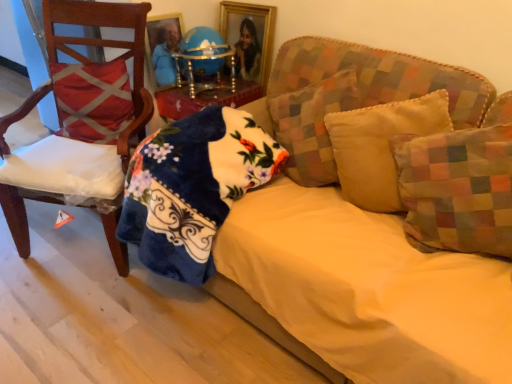
The height and width of the screenshot is (384, 512). Describe the element at coordinates (457, 190) in the screenshot. I see `multicolored fabric pillow at right, which is the first pillow from right to left` at that location.

This screenshot has width=512, height=384. What are the coordinates of `velvet yellow couch at center` in the screenshot? It's located at (368, 288).

This screenshot has height=384, width=512. Describe the element at coordinates (249, 37) in the screenshot. I see `gold/glass picture frame at upper center` at that location.

What is the approximate height of gold/glass picture frame at upper center?

It is 14.66 inches.

What do you see at coordinates (203, 56) in the screenshot? The height and width of the screenshot is (384, 512). I see `blue glossy globe at center` at bounding box center [203, 56].

The height and width of the screenshot is (384, 512). Identify the location of blue glossy globe at center. (203, 56).

I want to click on multicolored fabric pillow at right, the fourth pillow positioned from the left, so click(457, 190).

From a real-world perspective, is wooden chair at left on red fabric pillow at left, which is the 4th pillow in right-to-left order?

No, from a real-world perspective, wooden chair at left is not above red fabric pillow at left, which is the 4th pillow in right-to-left order.

Which point is more distant from viewer, (x=139, y=46) or (x=125, y=75)?

Positioned behind is point (x=139, y=46).

Consider the image. Are wooden chair at left and red fabric pillow at left, which ranks as the first pillow in left-to-right order, far apart?

They are positioned close to each other.

Considering the positions of points (230, 52) and (325, 150), is point (230, 52) farther from camera compared to point (325, 150)?

Yes.

Who is more distant, blue glossy globe at center or beige fabric pillow at center, which is counted as the third pillow, starting from the right?

blue glossy globe at center.

From a real-world perspective, is blue glossy globe at center on top of beige fabric pillow at center, which is the 2th pillow in left-to-right order?

Indeed, from a real-world perspective, blue glossy globe at center stands above beige fabric pillow at center, which is the 2th pillow in left-to-right order.

Looking at their sizes, would you say blue glossy globe at center is wider or thinner than beige fabric pillow at center, which is the 2th pillow in left-to-right order?

In the image, blue glossy globe at center appears to be more narrow than beige fabric pillow at center, which is the 2th pillow in left-to-right order.

Which object is positioned more to the right, multicolored fabric pillow at right, the fourth pillow positioned from the left, or fluffy blue blanket at lower left?

multicolored fabric pillow at right, the fourth pillow positioned from the left.

Where is `material located behind the multicolored fabric pillow at right, the fourth pillow positioned from the left`? This screenshot has width=512, height=384. material located behind the multicolored fabric pillow at right, the fourth pillow positioned from the left is located at coordinates (192, 188).

How different are the orientations of multicolored fabric pillow at right, which is the first pillow from right to left, and fluffy blue blanket at lower left in degrees?

multicolored fabric pillow at right, which is the first pillow from right to left, and fluffy blue blanket at lower left are facing 25.2 degrees away from each other.

Is wooden chair at left not within yellow fabric pillow at center, arranged as the 2th pillow when viewed from the right?

wooden chair at left lies outside yellow fabric pillow at center, arranged as the 2th pillow when viewed from the right,'s area.

Is wooden chair at left oriented towards yellow fabric pillow at center, arranged as the third pillow when viewed from the left?

No.

Which object is further away from the camera, wooden chair at left or yellow fabric pillow at center, arranged as the third pillow when viewed from the left?

Positioned behind is wooden chair at left.

Identify the location of chair below the yellow fabric pillow at center, arranged as the third pillow when viewed from the left (from a real-world perspective). (109, 47).

Who is shorter, gold/glass picture frame at upper center or velvet yellow couch at center?

Standing shorter between the two is gold/glass picture frame at upper center.

Would you say velvet yellow couch at center is part of gold/glass picture frame at upper center's contents?

That's incorrect, velvet yellow couch at center is not inside gold/glass picture frame at upper center.

How distant is gold/glass picture frame at upper center from velvet yellow couch at center?

gold/glass picture frame at upper center is 80.90 centimeters away from velvet yellow couch at center.

Does gold/glass picture frame at upper center have a greater width compared to velvet yellow couch at center?

In fact, gold/glass picture frame at upper center might be narrower than velvet yellow couch at center.

Considering the sizes of blue glossy globe at center and red fabric pillow at left, which is the 4th pillow in right-to-left order, in the image, is blue glossy globe at center wider or thinner than red fabric pillow at left, which is the 4th pillow in right-to-left order,?

blue glossy globe at center is wider than red fabric pillow at left, which is the 4th pillow in right-to-left order.

From the image's perspective, is blue glossy globe at center located above or below red fabric pillow at left, which ranks as the first pillow in left-to-right order?

From the image's perspective, blue glossy globe at center appears above red fabric pillow at left, which ranks as the first pillow in left-to-right order.

Could you measure the distance between beige fabric pillow at center, which is the 2th pillow in left-to-right order, and fluffy blue blanket at lower left?

A distance of 31.42 centimeters exists between beige fabric pillow at center, which is the 2th pillow in left-to-right order, and fluffy blue blanket at lower left.

Would you say beige fabric pillow at center, which is counted as the third pillow, starting from the right, is outside fluffy blue blanket at lower left?

Absolutely, beige fabric pillow at center, which is counted as the third pillow, starting from the right, is external to fluffy blue blanket at lower left.

From the image's perspective, is beige fabric pillow at center, which is the 2th pillow in left-to-right order, located above or below fluffy blue blanket at lower left?

Clearly, from the image's perspective, beige fabric pillow at center, which is the 2th pillow in left-to-right order, is above fluffy blue blanket at lower left.

Which of these two, beige fabric pillow at center, which is the 2th pillow in left-to-right order, or fluffy blue blanket at lower left, stands taller?

beige fabric pillow at center, which is the 2th pillow in left-to-right order, is taller.

What are the coordinates of `chair below the red fabric pillow at left, which ranks as the first pillow in left-to-right order (from the image's perspective)` in the screenshot? It's located at (109, 47).

At what (x,y) coordinates should I click in order to perform the action: click on pillow that is the 2nd one when counting forward from the blue glossy globe at center. Please return your answer as a coordinate pair (x, y). This screenshot has height=384, width=512. Looking at the image, I should click on (312, 126).

From the picture: Estimate the real-world distances between objects in this image. Which object is closer to blue glossy globe at center, gold/glass picture frame at upper center or multicolored fabric pillow at right, which is the first pillow from right to left?

gold/glass picture frame at upper center.

From the image, which object appears to be nearer to multicolored fabric pillow at right, which is the first pillow from right to left, velvet yellow couch at center or beige fabric pillow at center, which is the 2th pillow in left-to-right order?

velvet yellow couch at center lies closer to multicolored fabric pillow at right, which is the first pillow from right to left, than the other object.

From the picture: When comparing their distances from yellow fabric pillow at center, arranged as the third pillow when viewed from the left, does wooden chair at left or blue glossy globe at center seem closer?

Based on the image, blue glossy globe at center appears to be nearer to yellow fabric pillow at center, arranged as the third pillow when viewed from the left.

From the image, which object appears to be farther from fluffy blue blanket at lower left, multicolored fabric pillow at right, the fourth pillow positioned from the left, or blue glossy globe at center?

multicolored fabric pillow at right, the fourth pillow positioned from the left, lies further to fluffy blue blanket at lower left than the other object.

Based on their spatial positions, is beige fabric pillow at center, which is counted as the third pillow, starting from the right, or velvet yellow couch at center closer to wooden chair at left?

The object closer to wooden chair at left is beige fabric pillow at center, which is counted as the third pillow, starting from the right.

Based on their spatial positions, is yellow fabric pillow at center, arranged as the 2th pillow when viewed from the right, or fluffy blue blanket at lower left closer to gold/glass picture frame at upper center?

The object closer to gold/glass picture frame at upper center is fluffy blue blanket at lower left.

Considering their positions, is beige fabric pillow at center, which is counted as the third pillow, starting from the right, positioned further to wooden chair at left than blue glossy globe at center?

beige fabric pillow at center, which is counted as the third pillow, starting from the right, lies further to wooden chair at left than the other object.

Looking at the image, which one is located closer to multicolored fabric pillow at right, which is the first pillow from right to left, blue glossy globe at center or beige fabric pillow at center, which is counted as the third pillow, starting from the right?

beige fabric pillow at center, which is counted as the third pillow, starting from the right, is positioned closer to the anchor multicolored fabric pillow at right, which is the first pillow from right to left.

Image resolution: width=512 pixels, height=384 pixels. Find the location of `chair positioned between velvet yellow couch at center and gold/glass picture frame at upper center from near to far`. chair positioned between velvet yellow couch at center and gold/glass picture frame at upper center from near to far is located at coordinates (109, 47).

I want to click on picture frame between red fabric pillow at left, which is the 4th pillow in right-to-left order, and multicolored fabric pillow at right, which is the first pillow from right to left, from left to right, so click(249, 37).

Identify the location of toy between red fabric pillow at left, which ranks as the first pillow in left-to-right order, and beige fabric pillow at center, which is counted as the third pillow, starting from the right. This screenshot has width=512, height=384. (203, 56).

Locate an element on the screen. The height and width of the screenshot is (384, 512). pillow located between wooden chair at left and blue glossy globe at center in the left-right direction is located at coordinates click(92, 100).